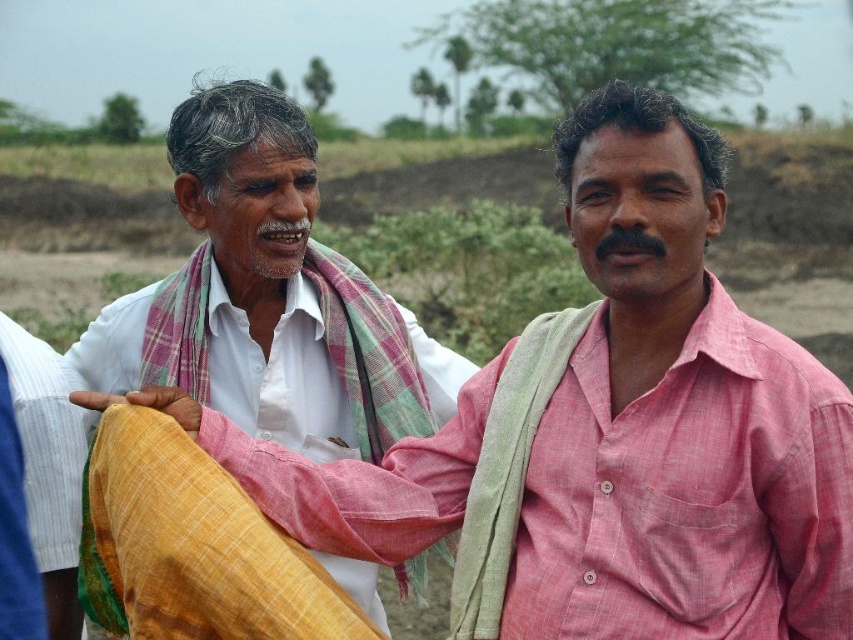
You are standing between the two people in the image. The person wearing the white cotton shirt at left wants to hand you a book. Can they reach you without moving closer?

The distance between the two people is 3.20 meters. Since the person wearing the white cotton shirt at left is 3.20 meters away, they would need to move closer to reach you to hand over the book.

You are a tailor measuring fabrics for a project. You have a white cotton shirt at left and a yellow woven cloth at center. Which fabric has a greater width?

The white cotton shirt at left has a greater width than the yellow woven cloth at center.

You are a photographer trying to capture a portrait of the two people in the scene. You want to ensure that the white cotton shirt at left and the yellow woven cloth at center are both visible in the frame. Given their sizes, which object should you focus on to ensure both are in the frame?

The white cotton shirt at left is taller than the yellow woven cloth at center, so focusing on the white cotton shirt at left would ensure both objects are visible in the frame since it is the taller object.